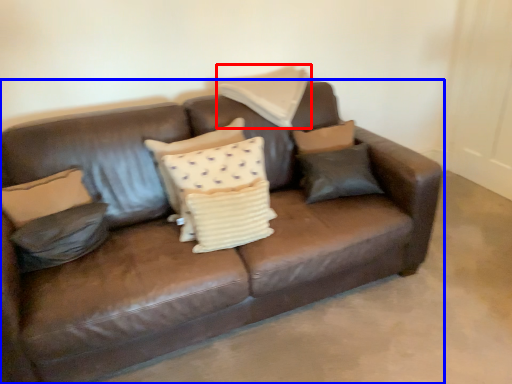
Question: Among these objects, which one is nearest to the camera, pillow (highlighted by a red box) or studio couch (highlighted by a blue box)?

Choices:
 (A) pillow
 (B) studio couch

Answer: (B)